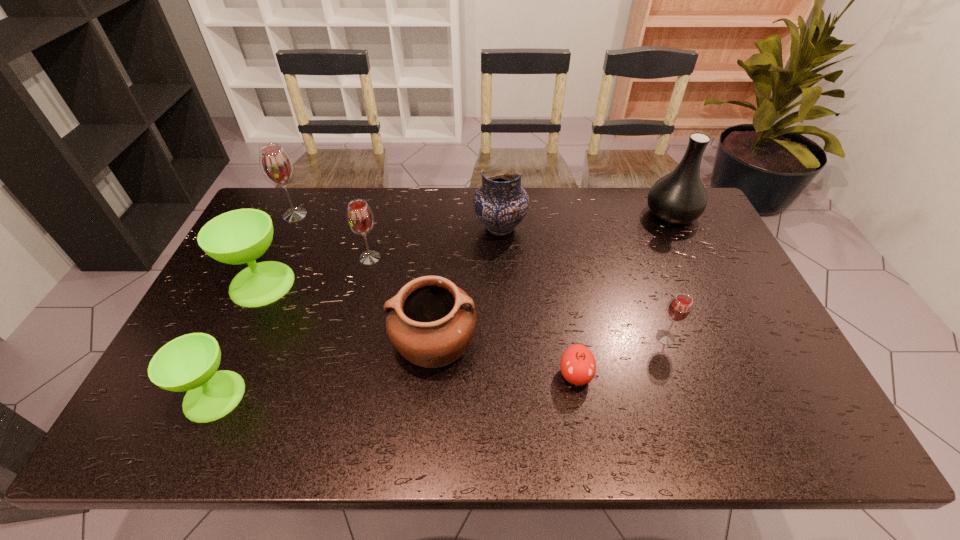
At what (x,y) coordinates should I click in order to perform the action: click on object situated at the far left corner. Please return your answer as a coordinate pair (x, y). Image resolution: width=960 pixels, height=540 pixels. Looking at the image, I should click on (276, 165).

Image resolution: width=960 pixels, height=540 pixels. What are the coordinates of `object that is at the near left corner` in the screenshot? It's located at (189, 363).

You are a GUI agent. You are given a task and a screenshot of the screen. Output one action in this format:
    pyautogui.click(x=<x>, y=<y>)
    Task: Click on the object positioned at the far right corner
    The image size is (960, 540).
    Given the screenshot: What is the action you would take?
    pyautogui.click(x=679, y=197)

Where is `free location at the far edge of the desktop`? free location at the far edge of the desktop is located at coordinates (340, 212).

In the image, there is a desktop. Where is `vacant space at the near edge`? The width and height of the screenshot is (960, 540). vacant space at the near edge is located at coordinates (362, 436).

Where is `vacant space at the right edge of the desktop`? vacant space at the right edge of the desktop is located at coordinates (704, 262).

I want to click on vacant region at the near left corner, so click(147, 425).

Where is `vacant point located between the reddish pottery and the nearest red wineglass`? vacant point located between the reddish pottery and the nearest red wineglass is located at coordinates (550, 340).

Locate an element on the screen. The height and width of the screenshot is (540, 960). vacant area that lies between the farther pottery and the red apple is located at coordinates (538, 301).

Find the location of a particular element. This screenshot has width=960, height=540. vacant space in between the nearest wineglass and the second red wineglass from left to right is located at coordinates (292, 327).